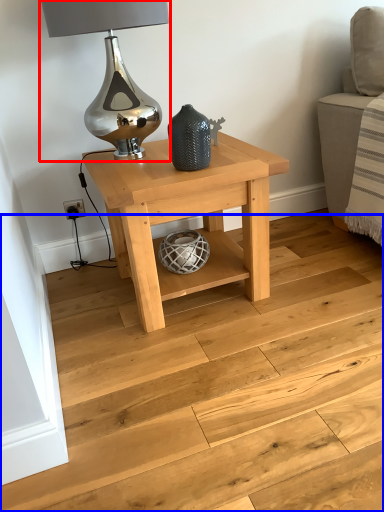
Question: Among these objects, which one is nearest to the camera, table lamp (highlighted by a red box) or stairwell (highlighted by a blue box)?

Choices:
 (A) table lamp
 (B) stairwell

Answer: (B)